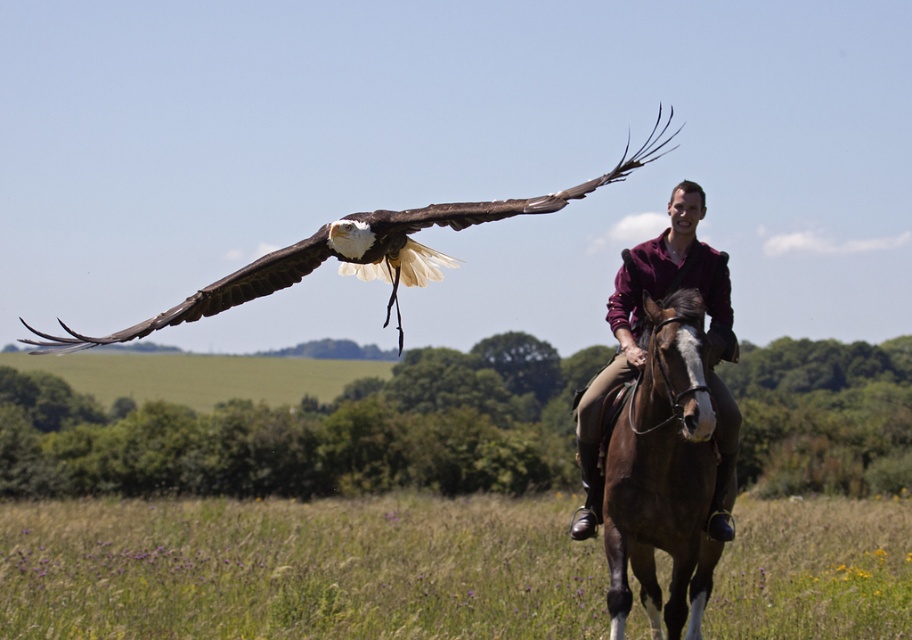
Does brown glossy horse at center have a larger size compared to maroon shirt at center?

Actually, brown glossy horse at center might be smaller than maroon shirt at center.

Is brown glossy horse at center wider than maroon shirt at center?

In fact, brown glossy horse at center might be narrower than maroon shirt at center.

Is point (649, 538) closer to viewer compared to point (628, 250)?

That is True.

You are a GUI agent. You are given a task and a screenshot of the screen. Output one action in this format:
    pyautogui.click(x=<x>, y=<y>)
    Task: Click on the brown glossy horse at center
    The width and height of the screenshot is (912, 640).
    Given the screenshot: What is the action you would take?
    pyautogui.click(x=662, y=474)

Who is positioned more to the left, brown feathered eagle at upper left or maroon shirt at center?

maroon shirt at center

Does point (565, 204) lie in front of point (688, 200)?

No, (565, 204) is behind (688, 200).

Where is `brown feathered eagle at upper left`? brown feathered eagle at upper left is located at coordinates (355, 250).

Can you confirm if brown glossy horse at center is taller than brown feathered eagle at upper left?

In fact, brown glossy horse at center may be shorter than brown feathered eagle at upper left.

Which is below, brown glossy horse at center or brown feathered eagle at upper left?

brown glossy horse at center is below.

Image resolution: width=912 pixels, height=640 pixels. Describe the element at coordinates (662, 474) in the screenshot. I see `brown glossy horse at center` at that location.

Where is `brown glossy horse at center`? This screenshot has width=912, height=640. brown glossy horse at center is located at coordinates (662, 474).